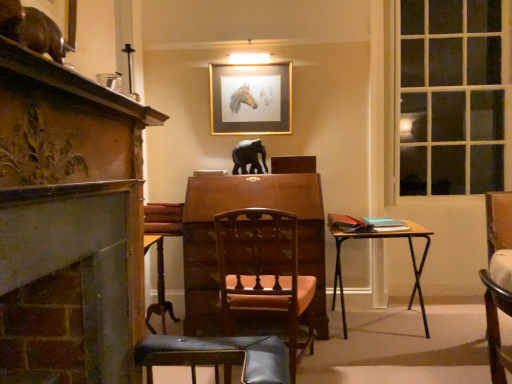
This screenshot has width=512, height=384. Find the location of `empty space that is ontop of gold metallic picture frame at upper center (from a real-world perspective)`. empty space that is ontop of gold metallic picture frame at upper center (from a real-world perspective) is located at coordinates (250, 60).